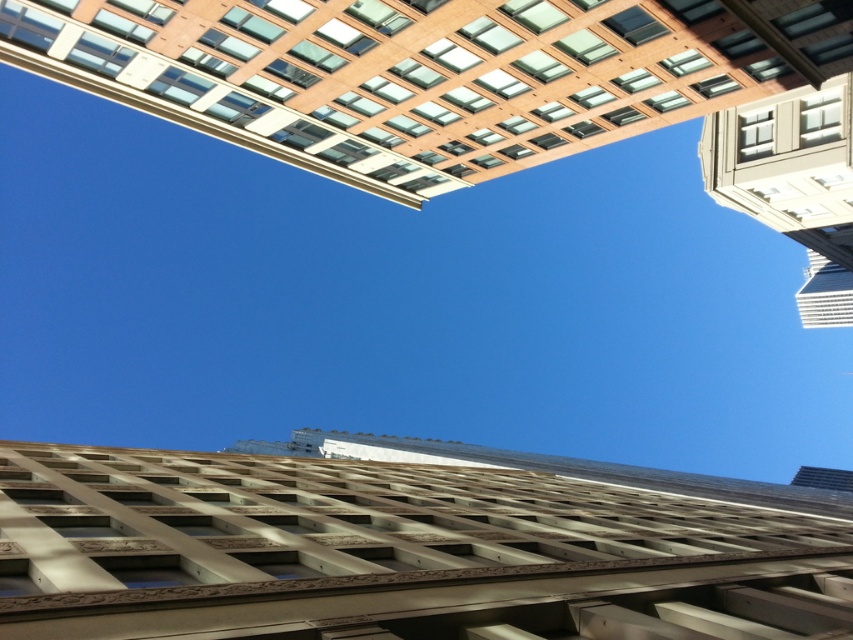
You are standing at the base of the beige textured facade at center and want to look towards the brown brick building at upper center. In which direction should you turn your head?

The beige textured facade at center is to the left of the brown brick building at upper center, so you should turn your head to the right to look towards the brown brick building at upper center.

You are standing at the base of the buildings and want to look up to a point that is closer to you. Which of the two points, point (471, 72) or point (842, 243), should you aim your camera at?

Point (471, 72) is closer to the viewer than point (842, 243), so you should aim your camera at point (471, 72).

You are a drone operator tasked with flying a drone between the beige textured facade at center and the white stone building at upper right. The drone has a wingspan of 1.2 meters. Based on the scene, can the drone safely navigate the space between them?

The distance between the beige textured facade at center and the white stone building at upper right is 51.71 meters, which is more than sufficient for the drone with a 1.2 meter wingspan to safely navigate the space between them.